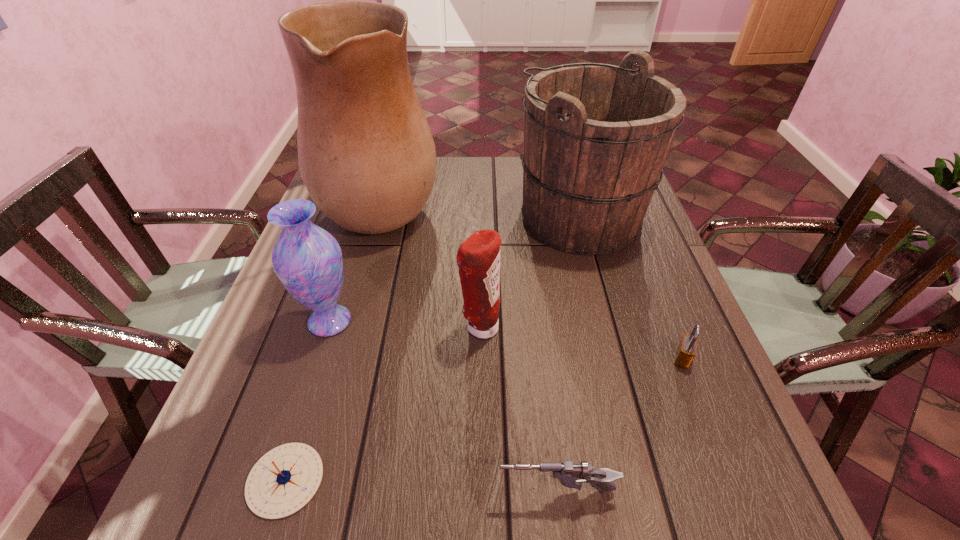
You are a GUI agent. You are given a task and a screenshot of the screen. Output one action in this format:
    pyautogui.click(x=<x>, y=<y>)
    Task: Click on the free space located 0.200m on the back of the condiment
    
    Given the screenshot: What is the action you would take?
    pyautogui.click(x=480, y=252)

Where is `free space located on the front of the padlock`? free space located on the front of the padlock is located at coordinates (709, 427).

This screenshot has height=540, width=960. Identify the location of vacant space situated at the barrel of the gun. (397, 491).

The height and width of the screenshot is (540, 960). What are the coordinates of `blank space located at the barrel of the gun` in the screenshot? It's located at (252, 491).

Identify the location of vacant position located 0.270m at the barrel of the gun. The height and width of the screenshot is (540, 960). (328, 491).

In order to click on vacant region located 0.090m on the right of the compass in this screenshot , I will do (x=377, y=480).

At what (x,y) coordinates should I click in order to perform the action: click on cream pitcher present at the far edge. Please return your answer as a coordinate pair (x, y). Looking at the image, I should click on (366, 154).

Where is `bucket positioned at the far edge`? bucket positioned at the far edge is located at coordinates (596, 136).

You are a GUI agent. You are given a task and a screenshot of the screen. Output one action in this format:
    pyautogui.click(x=<x>, y=<y>)
    Task: Click on the gun that is at the near edge
    The height and width of the screenshot is (540, 960).
    Given the screenshot: What is the action you would take?
    pyautogui.click(x=570, y=475)

Identify the location of compass situated at the near edge. pyautogui.click(x=284, y=480).